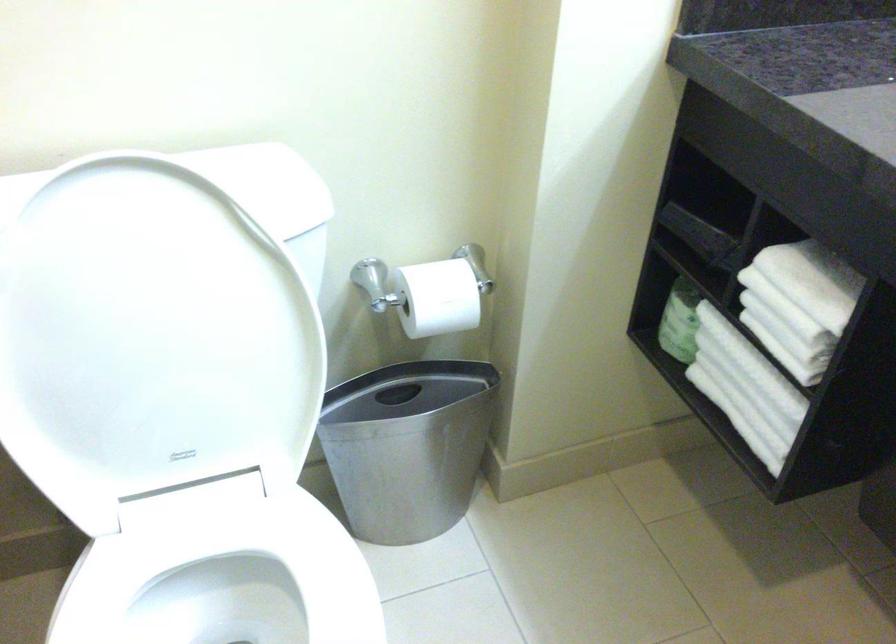
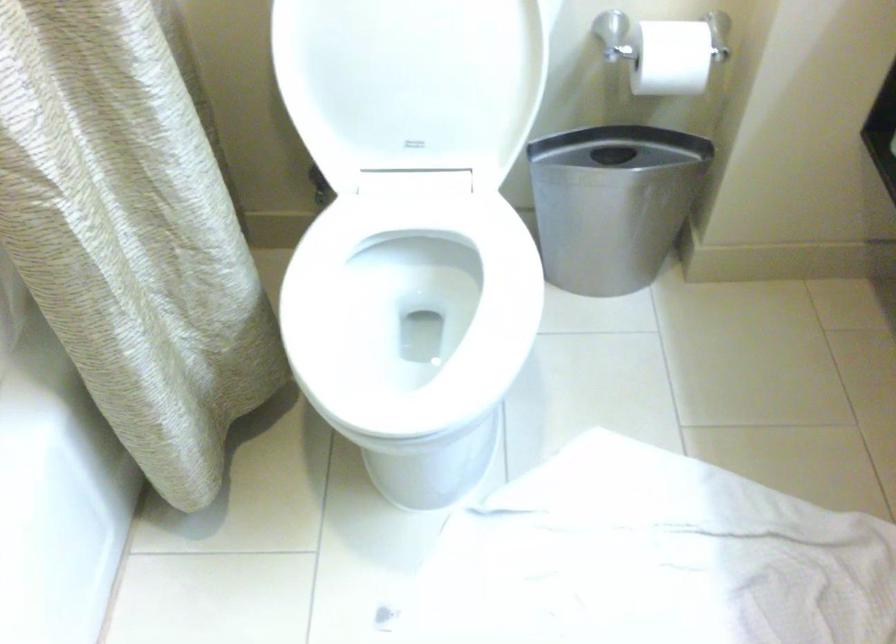
Consider the image. In a continuous first-person perspective shot, in which direction is the camera moving?

The cameraman walked toward right, backward.